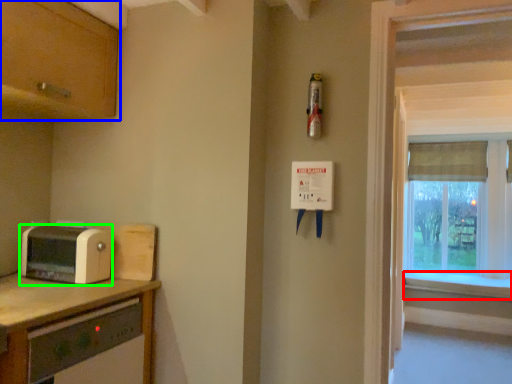
Question: Which is farther away from window sill (highlighted by a red box)? cabinetry (highlighted by a blue box) or toaster (highlighted by a green box)?

Choices:
 (A) cabinetry
 (B) toaster

Answer: (A)